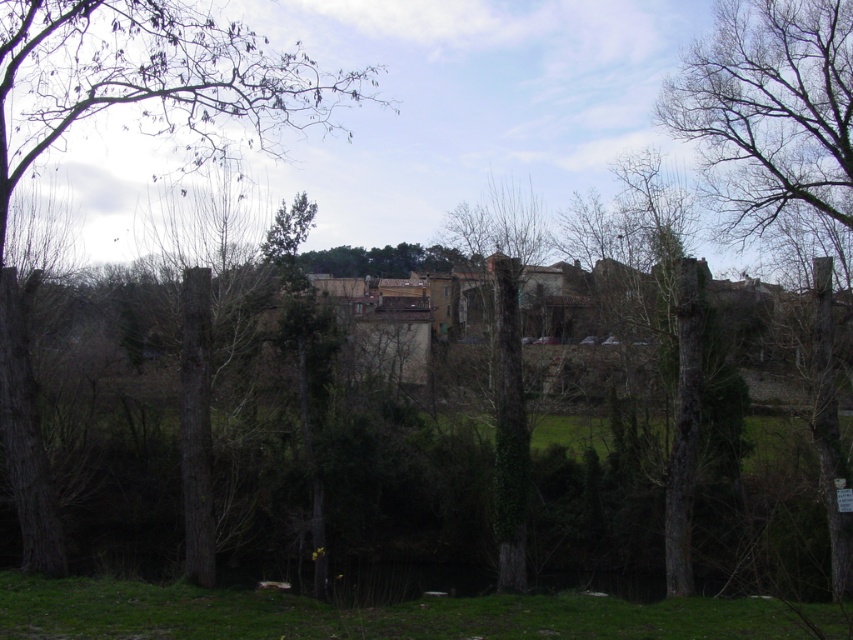
Who is lower down, smooth bark tree at right or green leafy tree at center?

green leafy tree at center

This screenshot has height=640, width=853. I want to click on smooth bark tree at right, so click(x=770, y=108).

The height and width of the screenshot is (640, 853). I want to click on smooth bark tree at right, so click(x=770, y=108).

Who is more forward, (x=45, y=552) or (x=500, y=392)?

Point (x=45, y=552) is in front.

Can you confirm if brown wood tree at left is positioned above green leafy tree at center?

Yes, brown wood tree at left is above green leafy tree at center.

Which is behind, point (28, 397) or point (473, 227)?

Positioned behind is point (473, 227).

At what (x,y) coordinates should I click in order to perform the action: click on brown wood tree at left. Please return your answer as a coordinate pair (x, y). Looking at the image, I should click on (138, 118).

Between brown wood tree at left and smooth bark tree at right, which one appears on the left side from the viewer's perspective?

brown wood tree at left is more to the left.

Is brown wood tree at left below smooth bark tree at right?

Actually, brown wood tree at left is above smooth bark tree at right.

Which is behind, point (33, 125) or point (822, 376)?

Positioned behind is point (33, 125).

This screenshot has height=640, width=853. What are the coordinates of `brown wood tree at left` in the screenshot? It's located at (138, 118).